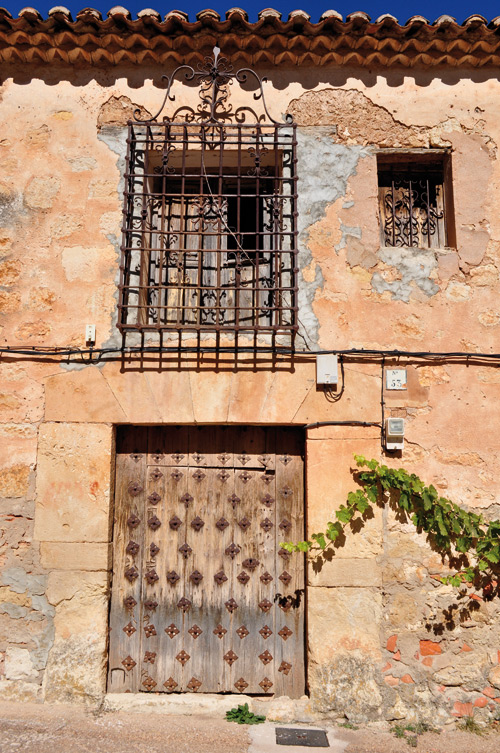
Where is `green plant right center`? This screenshot has height=753, width=500. green plant right center is located at coordinates (299, 546), (346, 520), (380, 474), (444, 504), (481, 529), (487, 559), (460, 577).